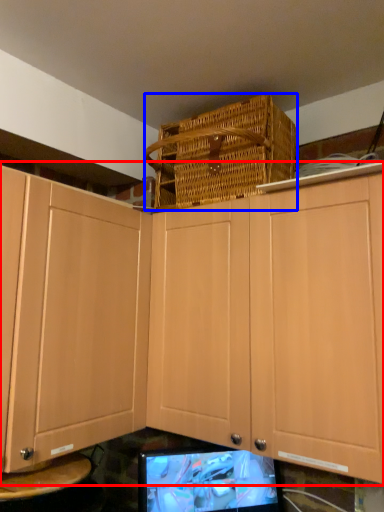
Question: Which object appears farthest to the camera in this image, cabinetry (highlighted by a red box) or basket (highlighted by a blue box)?

Choices:
 (A) cabinetry
 (B) basket

Answer: (B)